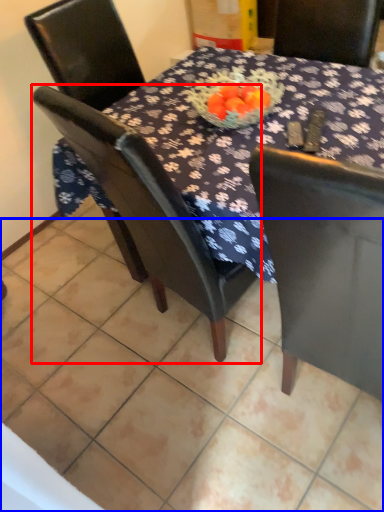
Question: Which of the following is the farthest to the observer, chair (highlighted by a red box) or tile (highlighted by a blue box)?

Choices:
 (A) chair
 (B) tile

Answer: (B)